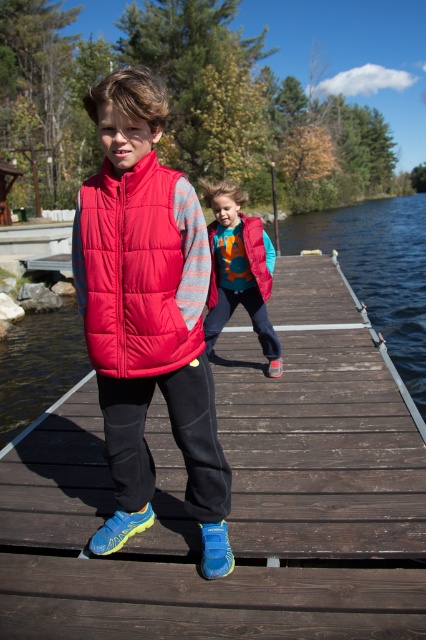
You are standing at the point with coordinates (x=236, y=497) on the dock. What object are you currently standing on?

You are standing on the wooden dock at center located at point (x=236, y=497).

You are a photographer trying to capture both the matte red vest at center and the matte pink vest at center in a single frame. Based on their positions, which vest should you focus on first to ensure both are in the shot?

The matte red vest at center is much taller than the matte pink vest at center, so you should focus on the matte red vest at center first to ensure both are in the shot.